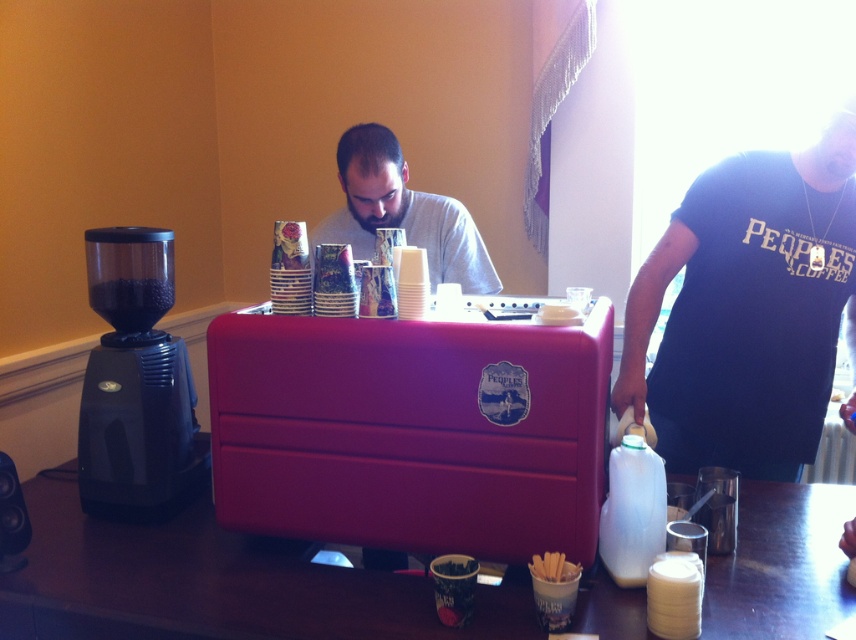
Question: Is matte plastic cooler at center behind black plastic coffee grinder at left?

Choices:
 (A) no
 (B) yes

Answer: (A)

Question: Is brown wooden table at center bigger than gray matte shirt at center?

Choices:
 (A) yes
 (B) no

Answer: (A)

Question: Which of the following is the closest to the observer?

Choices:
 (A) black plastic coffee grinder at left
 (B) matte plastic cooler at center
 (C) dark blue t-shirt at right

Answer: (B)

Question: Does matte plastic cooler at center come in front of brown wooden table at center?

Choices:
 (A) no
 (B) yes

Answer: (A)

Question: Based on their relative distances, which object is farther from the dark blue t-shirt at right?

Choices:
 (A) gray matte shirt at center
 (B) brown wooden table at center

Answer: (A)

Question: Among these objects, which one is farthest from the camera?

Choices:
 (A) matte plastic cooler at center
 (B) dark blue t-shirt at right

Answer: (B)